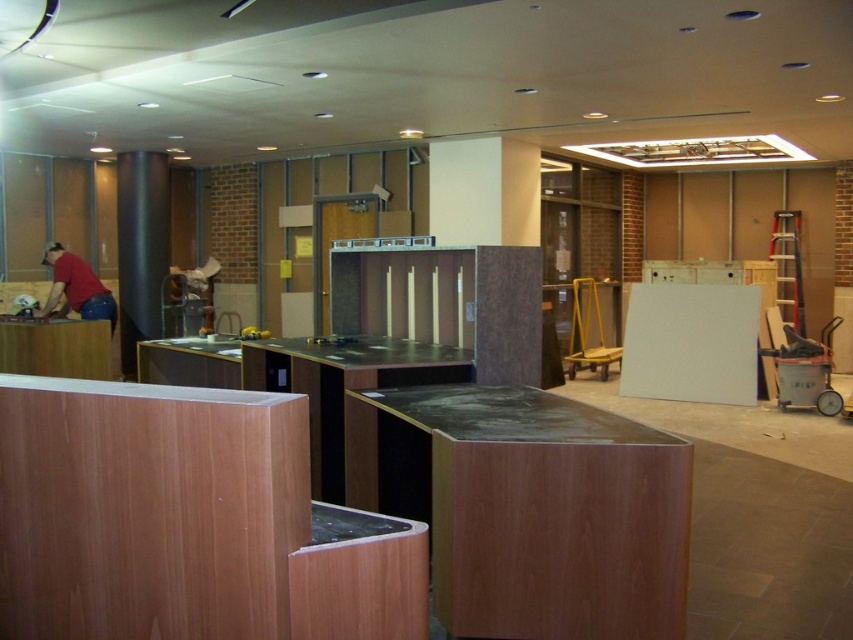
Question: Observing the image, what is the correct spatial positioning of metallic gray column at left in reference to matte red shirt at left?

Choices:
 (A) below
 (B) above

Answer: (B)

Question: Which of the following is the closest to the observer?

Choices:
 (A) (129, 332)
 (B) (42, 314)

Answer: (B)

Question: Does metallic gray column at left have a lesser width compared to matte red shirt at left?

Choices:
 (A) no
 (B) yes

Answer: (B)

Question: Which of the following is the closest to the observer?

Choices:
 (A) (99, 310)
 (B) (167, 237)

Answer: (A)

Question: Considering the relative positions of metallic gray column at left and matte red shirt at left in the image provided, where is metallic gray column at left located with respect to matte red shirt at left?

Choices:
 (A) below
 (B) above

Answer: (B)

Question: Which of the following is the farthest from the observer?

Choices:
 (A) (166, 220)
 (B) (80, 285)

Answer: (A)